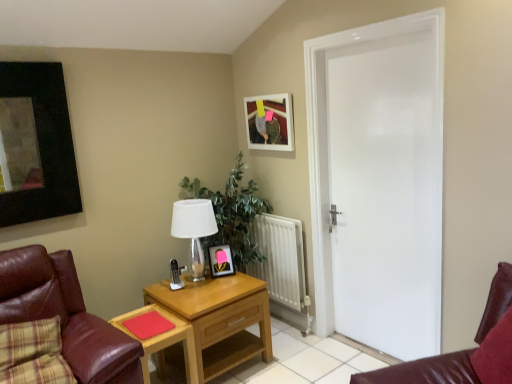
Question: Is wooden nightstand at center taller than matte black picture frame at center, the 1th picture frame from the left?

Choices:
 (A) no
 (B) yes

Answer: (B)

Question: From the image's perspective, would you say wooden nightstand at center is positioned over matte black picture frame at center, the 1th picture frame from the left?

Choices:
 (A) no
 (B) yes

Answer: (A)

Question: Is wooden nightstand at center closer to the viewer compared to matte black picture frame at center, which is counted as the first picture frame, starting from the bottom?

Choices:
 (A) yes
 (B) no

Answer: (A)

Question: Is wooden nightstand at center at the right side of matte black picture frame at center, the 2th picture frame from the right?

Choices:
 (A) no
 (B) yes

Answer: (A)

Question: From the image's perspective, is wooden nightstand at center located beneath matte black picture frame at center, placed as the 2th picture frame when sorted from top to bottom?

Choices:
 (A) no
 (B) yes

Answer: (B)

Question: Considering their positions, is matte black picture frame at center, placed as the 2th picture frame when sorted from top to bottom, located in front of or behind smooth red paper at lower center?

Choices:
 (A) behind
 (B) front

Answer: (A)

Question: Is matte black picture frame at center, the 2th picture frame from the right, taller or shorter than smooth red paper at lower center?

Choices:
 (A) short
 (B) tall

Answer: (B)

Question: Is point (216, 246) positioned closer to the camera than point (135, 327)?

Choices:
 (A) closer
 (B) farther

Answer: (B)

Question: Is matte black picture frame at center, the 1th picture frame from the left, bigger or smaller than smooth red paper at lower center?

Choices:
 (A) big
 (B) small

Answer: (A)

Question: Do you think smooth red paper at lower center is within leather at left, or outside of it?

Choices:
 (A) outside
 (B) inside

Answer: (A)

Question: Based on their sizes in the image, would you say smooth red paper at lower center is bigger or smaller than leather at left?

Choices:
 (A) big
 (B) small

Answer: (B)

Question: From their relative heights in the image, would you say smooth red paper at lower center is taller or shorter than leather at left?

Choices:
 (A) short
 (B) tall

Answer: (A)

Question: Is point (131, 322) positioned closer to the camera than point (108, 380)?

Choices:
 (A) closer
 (B) farther

Answer: (B)

Question: Considering the positions of wooden table at center and matte black picture frame at center, which is counted as the first picture frame, starting from the bottom, in the image, is wooden table at center taller or shorter than matte black picture frame at center, which is counted as the first picture frame, starting from the bottom,?

Choices:
 (A) tall
 (B) short

Answer: (A)

Question: Is wooden table at center situated inside matte black picture frame at center, the 1th picture frame from the left, or outside?

Choices:
 (A) inside
 (B) outside

Answer: (B)